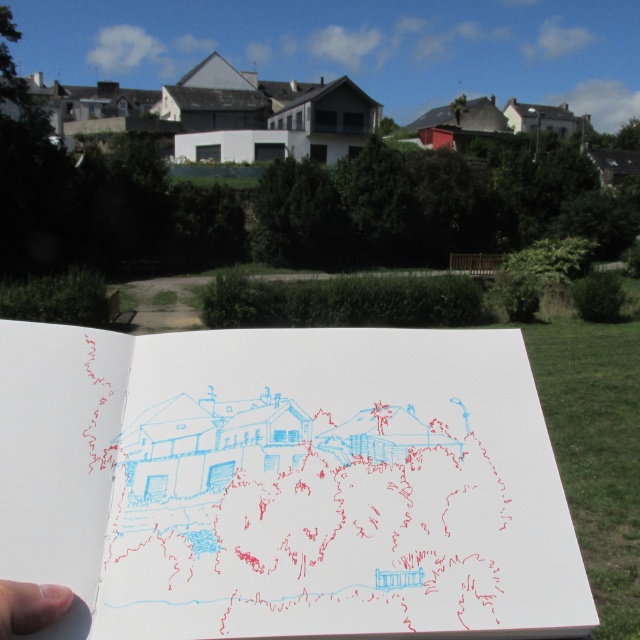
Question: Is white paper at center bigger than skinny flesh at lower left?

Choices:
 (A) no
 (B) yes

Answer: (B)

Question: Which of the following is the farthest from the observer?

Choices:
 (A) skinny flesh at lower left
 (B) white paper at center

Answer: (B)

Question: Can you confirm if white paper at center is wider than skinny flesh at lower left?

Choices:
 (A) yes
 (B) no

Answer: (A)

Question: From the image, what is the correct spatial relationship of white paper at center in relation to skinny flesh at lower left?

Choices:
 (A) above
 (B) below

Answer: (A)

Question: Which point is closer to the camera taking this photo?

Choices:
 (A) (4, 614)
 (B) (152, 554)

Answer: (A)